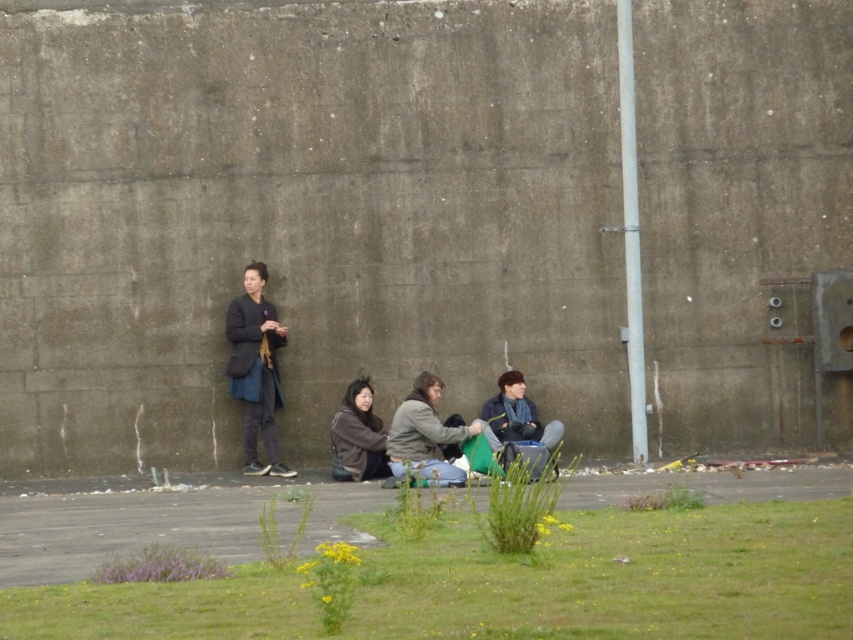
Question: Can you confirm if gray concrete wall at center is positioned below brown fuzzy jacket at lower center?

Choices:
 (A) yes
 (B) no

Answer: (B)

Question: Is green grass at lower center to the right of brown fuzzy jacket at lower center from the viewer's perspective?

Choices:
 (A) yes
 (B) no

Answer: (A)

Question: Is green grass at lower center wider than dark blue fabric coat at center?

Choices:
 (A) no
 (B) yes

Answer: (B)

Question: Which object is the closest to the green grass at lower center?

Choices:
 (A) dark blue jacket at center
 (B) brown fuzzy jacket at lower center

Answer: (B)

Question: Among these objects, which one is nearest to the camera?

Choices:
 (A) brown fuzzy jacket at lower center
 (B) green grass at lower center
 (C) matte gray jacket at center

Answer: (B)

Question: Which object appears farthest from the camera in this image?

Choices:
 (A) gray concrete wall at center
 (B) green grass at lower center

Answer: (A)